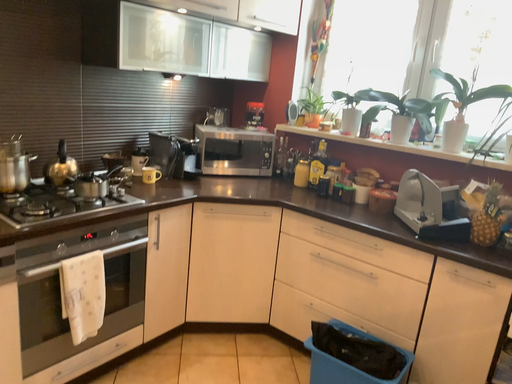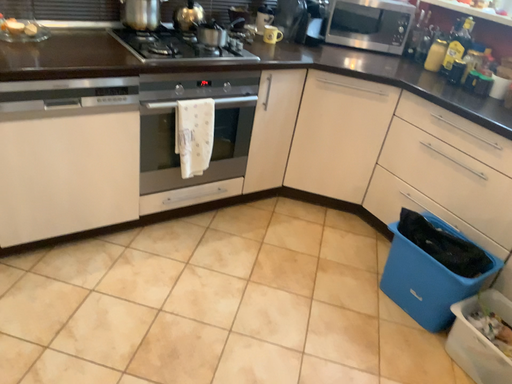
Question: How did the camera likely rotate when shooting the video?

Choices:
 (A) rotated right
 (B) rotated left

Answer: (B)